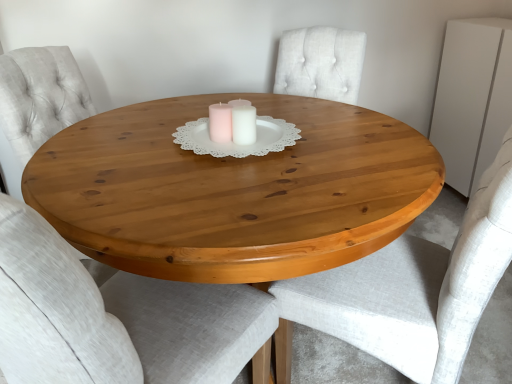
Locate an element on the screen. This screenshot has width=512, height=384. light gray fabric chair at right, arranged as the 1th chair when viewed from the right is located at coordinates (411, 290).

This screenshot has width=512, height=384. What do you see at coordinates (233, 191) in the screenshot?
I see `natural wood table at center` at bounding box center [233, 191].

What do you see at coordinates (472, 98) in the screenshot?
I see `white matte dresser at upper right` at bounding box center [472, 98].

What are the coordinates of `white matte candle at center` in the screenshot? It's located at (233, 122).

Is white matte dresser at upper right not inside white matte candle at center?

That's correct, white matte dresser at upper right is outside of white matte candle at center.

Considering the relative sizes of white matte dresser at upper right and white matte candle at center in the image provided, is white matte dresser at upper right thinner than white matte candle at center?

Incorrect, the width of white matte dresser at upper right is not less than that of white matte candle at center.

Is there a large distance between white matte dresser at upper right and white matte candle at center?

Yes, white matte dresser at upper right and white matte candle at center are located far from each other.

Considering the relative positions of white matte dresser at upper right and white matte candle at center in the image provided, is white matte dresser at upper right behind white matte candle at center?

Yes, white matte dresser at upper right is behind white matte candle at center.

Is natural wood table at center a part of white matte dresser at upper right?

No.

Is white matte dresser at upper right facing towards natural wood table at center?

Yes, white matte dresser at upper right is oriented towards natural wood table at center.

Between white matte dresser at upper right and natural wood table at center, which one has more height?

With more height is natural wood table at center.

From a real-world perspective, relative to natural wood table at center, is white matte dresser at upper right vertically above or below?

white matte dresser at upper right is above natural wood table at center.

In the image, is white matte dresser at upper right positioned in front of or behind white paper doily at center?

Clearly, white matte dresser at upper right is behind white paper doily at center.

Is white matte dresser at upper right positioned far away from white paper doily at center?

Yes.

From the image's perspective, is white matte dresser at upper right under white paper doily at center?

No.

Can you tell me how much white matte dresser at upper right and white paper doily at center differ in facing direction?

The angle between the facing direction of white matte dresser at upper right and the facing direction of white paper doily at center is 78 degrees.

In the image, is white paper doily at center positioned in front of or behind light gray fabric chair at right, arranged as the 1th chair when viewed from the right?

Visually, white paper doily at center is located behind light gray fabric chair at right, arranged as the 1th chair when viewed from the right.

Do you think white paper doily at center is within light gray fabric chair at right, which is counted as the second chair, starting from the left, or outside of it?

white paper doily at center is located beyond the bounds of light gray fabric chair at right, which is counted as the second chair, starting from the left.

In terms of width, does white paper doily at center look wider or thinner when compared to light gray fabric chair at right, arranged as the 1th chair when viewed from the right?

Clearly, white paper doily at center has less width compared to light gray fabric chair at right, arranged as the 1th chair when viewed from the right.

From the image's perspective, which is above, white paper doily at center or light gray fabric chair at right, which is counted as the second chair, starting from the left?

white paper doily at center, from the image's perspective.

From the picture: From the image's perspective, is white matte dresser at upper right under light gray fabric chair at center, arranged as the second chair when viewed from the right?

No, from the image's perspective, white matte dresser at upper right is not beneath light gray fabric chair at center, arranged as the second chair when viewed from the right.

In terms of height, does white matte dresser at upper right look taller or shorter compared to light gray fabric chair at center, arranged as the second chair when viewed from the right?

Considering their sizes, white matte dresser at upper right has less height than light gray fabric chair at center, arranged as the second chair when viewed from the right.

Which object is positioned more to the left, white matte dresser at upper right or light gray fabric chair at center, arranged as the second chair when viewed from the right?

Positioned to the left is light gray fabric chair at center, arranged as the second chair when viewed from the right.

In the scene shown: Relative to light gray fabric chair at center, marked as the first chair in a left-to-right arrangement, is white matte dresser at upper right in front or behind?

Clearly, white matte dresser at upper right is behind light gray fabric chair at center, marked as the first chair in a left-to-right arrangement.

Is natural wood table at center oriented towards white paper doily at center?

No, natural wood table at center is not turned towards white paper doily at center.

Is natural wood table at center far away from white paper doily at center?

natural wood table at center is near white paper doily at center, not far away.

Is natural wood table at center smaller than white paper doily at center?

No.

From a real-world perspective, is natural wood table at center below white paper doily at center?

Yes, from a real-world perspective, natural wood table at center is beneath white paper doily at center.

From the picture: Between white paper doily at center and white matte candle at center, which one is positioned in front?

white paper doily at center is in front.

Is white paper doily at center taller or shorter than white matte candle at center?

Considering their sizes, white paper doily at center has less height than white matte candle at center.

Is white paper doily at center not near white matte candle at center?

No, white paper doily at center is not far from white matte candle at center.

Which is farther from the camera, (232,143) or (234,109)?

The point (234,109) is farther.

Where is `candle holder that appears in front of the white matte dresser at upper right`? This screenshot has width=512, height=384. candle holder that appears in front of the white matte dresser at upper right is located at coordinates click(233, 122).

You are a GUI agent. You are given a task and a screenshot of the screen. Output one action in this format:
    pyautogui.click(x=<x>, y=<y>)
    Task: Click on the coffee table located on the left of white matte dresser at upper right
    
    Given the screenshot: What is the action you would take?
    pyautogui.click(x=233, y=191)

Looking at the image, which one is located further to light gray fabric chair at right, arranged as the 1th chair when viewed from the right, white matte dresser at upper right or white matte candle at center?

The object further to light gray fabric chair at right, arranged as the 1th chair when viewed from the right, is white matte dresser at upper right.

In the scene shown: Considering their positions, is white paper doily at center positioned closer to light gray fabric chair at right, which is counted as the second chair, starting from the left, than natural wood table at center?

natural wood table at center is closer to light gray fabric chair at right, which is counted as the second chair, starting from the left.

From the image, which object appears to be farther from light gray fabric chair at right, arranged as the 1th chair when viewed from the right, white matte candle at center or natural wood table at center?

The object further to light gray fabric chair at right, arranged as the 1th chair when viewed from the right, is white matte candle at center.

Estimate the real-world distances between objects in this image. Which object is further from natural wood table at center, light gray fabric chair at center, marked as the first chair in a left-to-right arrangement, or white matte candle at center?

light gray fabric chair at center, marked as the first chair in a left-to-right arrangement.

Which object lies further to the anchor point natural wood table at center, light gray fabric chair at right, arranged as the 1th chair when viewed from the right, or white matte candle at center?

Among the two, light gray fabric chair at right, arranged as the 1th chair when viewed from the right, is located further to natural wood table at center.

From the image, which object appears to be farther from white matte candle at center, white matte dresser at upper right or light gray fabric chair at right, arranged as the 1th chair when viewed from the right?

Among the two, white matte dresser at upper right is located further to white matte candle at center.

Estimate the real-world distances between objects in this image. Which object is further from white matte dresser at upper right, white paper doily at center or white matte candle at center?

white matte candle at center is further to white matte dresser at upper right.

When comparing their distances from white matte dresser at upper right, does light gray fabric chair at right, which is counted as the second chair, starting from the left, or white paper doily at center seem closer?

Among the two, light gray fabric chair at right, which is counted as the second chair, starting from the left, is located nearer to white matte dresser at upper right.

Find the location of `chair situated between white paper doily at center and white matte dresser at upper right from left to right`. chair situated between white paper doily at center and white matte dresser at upper right from left to right is located at coordinates (411, 290).

The image size is (512, 384). What are the coordinates of `chair located between natural wood table at center and white matte dresser at upper right in the left-right direction` in the screenshot? It's located at (411, 290).

This screenshot has height=384, width=512. Identify the location of coffee table between light gray fabric chair at right, arranged as the 1th chair when viewed from the right, and white matte candle at center in the front-back direction. (233, 191).

I want to click on coffee table between white paper doily at center and white matte dresser at upper right in the horizontal direction, so [233, 191].